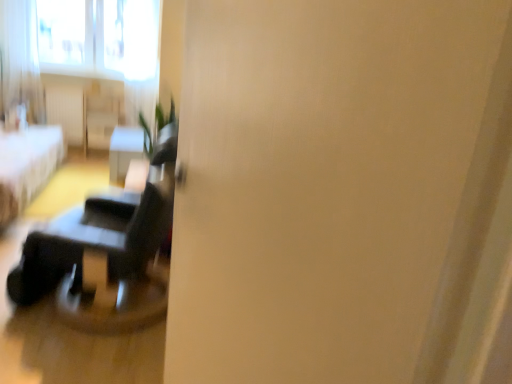
Question: From the image's perspective, relative to white fabric bed at left, is matte black table at center above or below?

Choices:
 (A) below
 (B) above

Answer: (A)

Question: In terms of height, does matte black table at center look taller or shorter compared to white fabric bed at left?

Choices:
 (A) short
 (B) tall

Answer: (A)

Question: Estimate the real-world distances between objects in this image. Which object is farther from the white fabric bed at left?

Choices:
 (A) white sheer curtain at upper left
 (B) matte black table at center

Answer: (A)

Question: Estimate the real-world distances between objects in this image. Which object is farther from the white sheer curtain at upper left?

Choices:
 (A) matte black table at center
 (B) white fabric bed at left

Answer: (A)